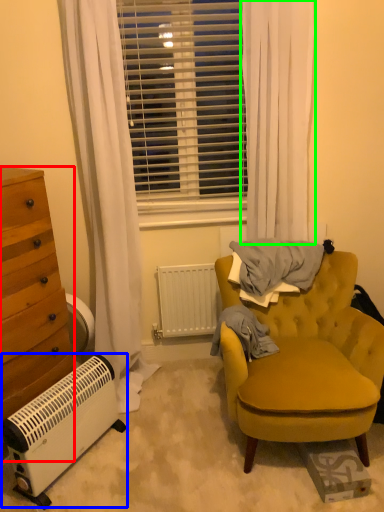
Question: Which object is positioned farthest from cabinetry (highlighted by a red box)? Select from air conditioning (highlighted by a blue box) and curtain (highlighted by a green box).

Choices:
 (A) air conditioning
 (B) curtain

Answer: (B)